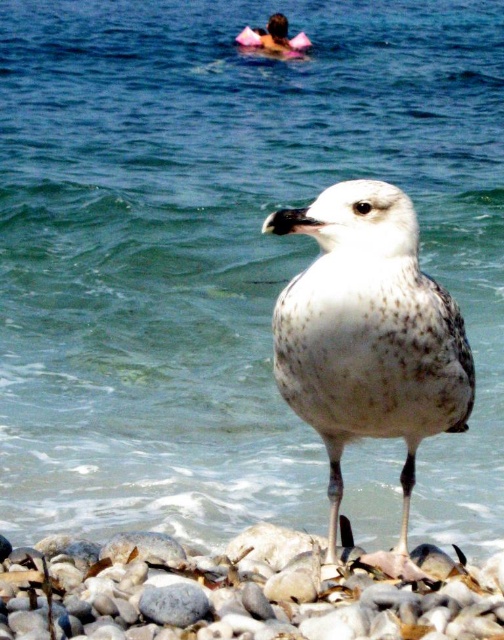
Question: Which point is closer to the camera taking this photo?

Choices:
 (A) (399, 355)
 (B) (57, 630)

Answer: (B)

Question: Is smooth gray rock at lower center bigger than white speckled feathered bird at center?

Choices:
 (A) no
 (B) yes

Answer: (A)

Question: Which point is closer to the camera?

Choices:
 (A) smooth gray rock at lower center
 (B) white speckled feathered bird at center

Answer: (B)

Question: Does smooth gray rock at lower center have a smaller size compared to white speckled feathered bird at center?

Choices:
 (A) yes
 (B) no

Answer: (A)

Question: Which object is closer to the camera taking this photo?

Choices:
 (A) white speckled feathered bird at center
 (B) smooth gray rock at lower center

Answer: (A)

Question: Is smooth gray rock at lower center wider than white speckled feathered bird at center?

Choices:
 (A) no
 (B) yes

Answer: (B)